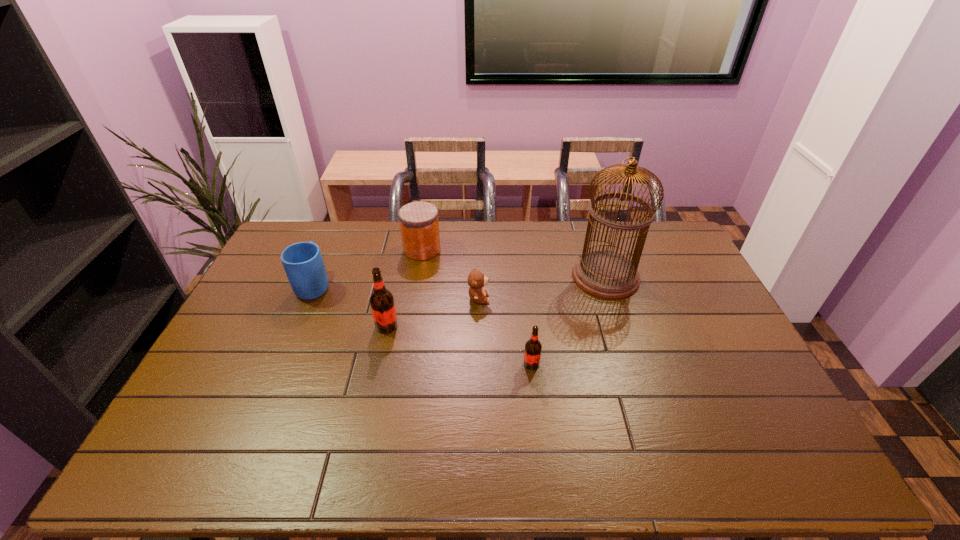
The image size is (960, 540). Identify the location of vacant space located 0.140m on the front of the taller root beer. (377, 372).

Locate an element on the screen. This screenshot has width=960, height=540. free space located on the right of the nearer root beer is located at coordinates 588,363.

Identify the location of vacant space positioned on the front-facing side of the tallest object. (541, 276).

Where is `vacant space located on the front-facing side of the tallest object`? This screenshot has width=960, height=540. vacant space located on the front-facing side of the tallest object is located at coordinates (536, 276).

Where is `vacant region located on the front-facing side of the tallest object`? This screenshot has height=540, width=960. vacant region located on the front-facing side of the tallest object is located at coordinates (530, 276).

Where is `free space located on the back of the jar`? This screenshot has height=540, width=960. free space located on the back of the jar is located at coordinates (425, 228).

Identify the location of blank space located 0.290m on the side of the leftmost object with the handle. This screenshot has width=960, height=540. (341, 223).

Locate an element on the screen. This screenshot has width=960, height=540. vacant space located 0.070m on the side of the leftmost object with the handle is located at coordinates (326, 257).

At what (x,y) coordinates should I click in order to perform the action: click on free point located on the side of the leftmost object with the handle. Please return your answer as a coordinate pair (x, y). Looking at the image, I should click on (335, 236).

This screenshot has width=960, height=540. What are the coordinates of `vacant space located on the face of the shortest object` in the screenshot? It's located at (571, 299).